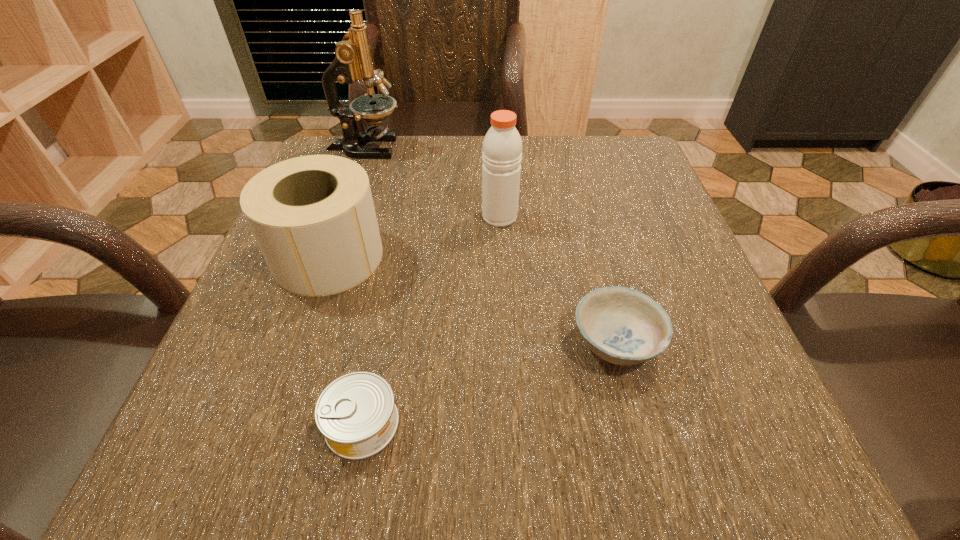
Locate an element on the screen. microscope is located at coordinates (353, 61).

Find the location of a particular element. the tallest object is located at coordinates (353, 61).

Locate an element on the screen. The width and height of the screenshot is (960, 540). shaker is located at coordinates (502, 146).

At what (x,y) coordinates should I click in order to perform the action: click on the second tallest object. Please return your answer as a coordinate pair (x, y). This screenshot has width=960, height=540. Looking at the image, I should click on (502, 146).

Locate an element on the screen. toilet tissue is located at coordinates (313, 217).

Locate an element on the screen. bowl is located at coordinates click(623, 326).

Where is `the rightmost object`? The height and width of the screenshot is (540, 960). the rightmost object is located at coordinates (623, 326).

Where is `the nearest object`? This screenshot has width=960, height=540. the nearest object is located at coordinates (356, 413).

At what (x,y) coordinates should I click in order to perform the action: click on free space located 0.320m at the eyepiece of the tallest object. Please return your answer as a coordinate pair (x, y). This screenshot has height=540, width=960. Looking at the image, I should click on (537, 148).

You are a GUI agent. You are given a task and a screenshot of the screen. Output one action in this format:
    pyautogui.click(x=<x>, y=<y>)
    Task: Click on the vacant space located 0.100m on the front of the fourth shortest object
    
    Given the screenshot: What is the action you would take?
    pyautogui.click(x=502, y=264)